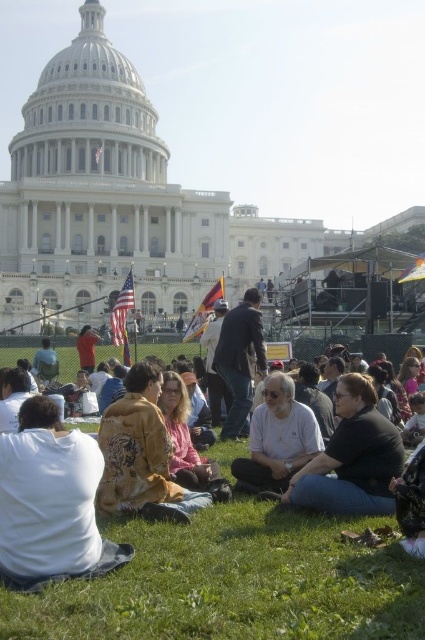
You are standing at the entrance of the United States Capitol building and see a person wearing a dark gray fabric jacket at center. If you want to locate this person, where should you look based on the coordinates provided?

The dark gray fabric jacket at center is located at coordinates point (351, 458), meaning you should look towards the lower right area of the image.

You are a photographer standing at the edge of the crowd near the Capitol building. You want to take a photo that includes both the gold textured jacket at center and the dark gray fabric jacket at center. Given that your camera has a maximum zoom range that can capture objects up to 10 meters apart, will you be able to fit both jackets in the same frame?

The gold textured jacket at center and dark gray fabric jacket at center are 10.04 meters apart, which exceeds the camera maximum zoom range of 10 meters. Therefore, you cannot fit both jackets in the same frame.

You are standing at the United States Capitol building and want to take a photo of the iconic dome. There are two points marked on your map as potential spots to take the picture. The first point is at coordinates point (14, 634) and the second is at point (122, 490). According to the scene description, which point is closer to the Capitol building?

Point (14, 634) is in front of point (122, 490), so it is closer to the Capitol building.